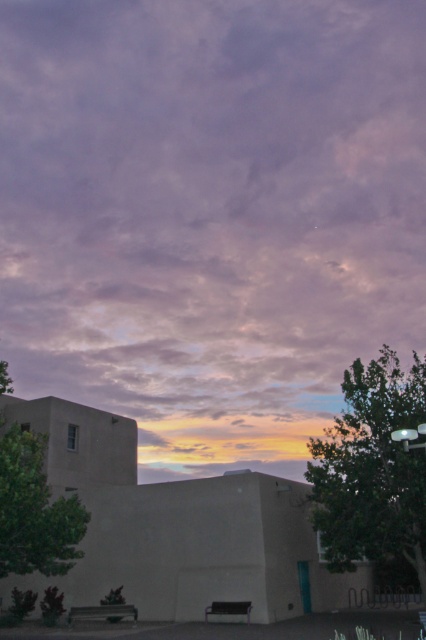
Question: Which object appears farthest from the camera in this image?

Choices:
 (A) green leafy tree at right
 (B) purple matte cloud at upper center
 (C) green leafy tree at left

Answer: (B)

Question: Is purple matte cloud at upper center to the left of green leafy tree at right from the viewer's perspective?

Choices:
 (A) yes
 (B) no

Answer: (A)

Question: Which object appears farthest from the camera in this image?

Choices:
 (A) green leafy tree at left
 (B) purple matte cloud at upper center

Answer: (B)

Question: Does green leafy tree at right have a smaller size compared to green leafy tree at left?

Choices:
 (A) yes
 (B) no

Answer: (A)

Question: Does purple matte cloud at upper center come behind green leafy tree at left?

Choices:
 (A) no
 (B) yes

Answer: (B)

Question: Which point is closer to the camera?

Choices:
 (A) (356, 20)
 (B) (356, 401)

Answer: (B)